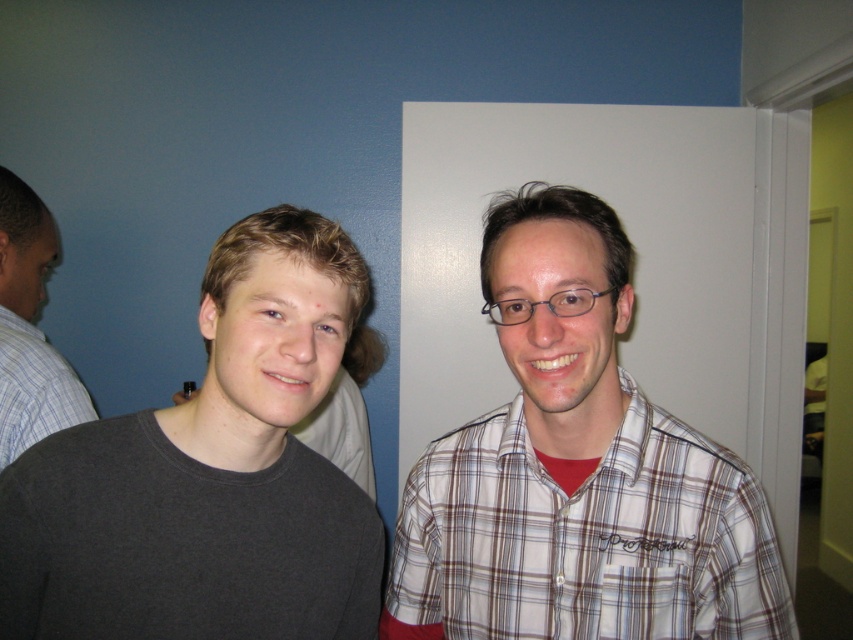
Between dark gray matte shirt at left and gray cotton shirt at left, which one appears on the left side from the viewer's perspective?

gray cotton shirt at left

Locate an element on the screen. dark gray matte shirt at left is located at coordinates (210, 474).

What do you see at coordinates (210, 474) in the screenshot?
I see `dark gray matte shirt at left` at bounding box center [210, 474].

The width and height of the screenshot is (853, 640). Describe the element at coordinates (210, 474) in the screenshot. I see `dark gray matte shirt at left` at that location.

Identify the location of dark gray matte shirt at left. (210, 474).

Is point (640, 524) farther from viewer compared to point (45, 365)?

No, it is not.

The image size is (853, 640). In order to click on plaid shirt at right in this screenshot , I will do `click(585, 538)`.

Identify the location of plaid shirt at right. (585, 538).